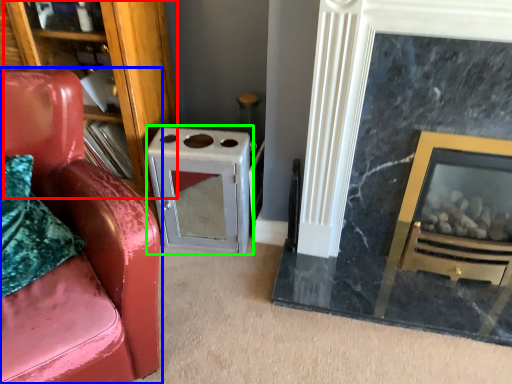
Question: Which is farther away from bookshelf (highlighted by a red box)? chair (highlighted by a blue box) or appliance (highlighted by a green box)?

Choices:
 (A) chair
 (B) appliance

Answer: (A)